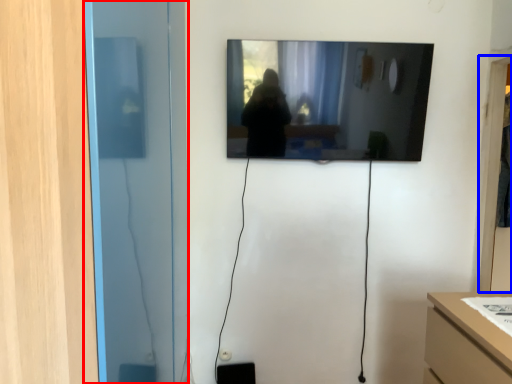
Question: Which object is closer to the camera taking this photo, glass door (highlighted by a red box) or glass door (highlighted by a blue box)?

Choices:
 (A) glass door
 (B) glass door

Answer: (A)